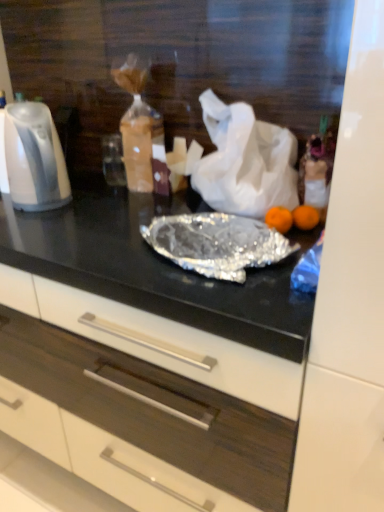
Question: Does white matte drawer at center have a greater height compared to white glossy electric kettle at left?

Choices:
 (A) no
 (B) yes

Answer: (B)

Question: Would you say white glossy electric kettle at left is part of white matte drawer at center's contents?

Choices:
 (A) no
 (B) yes

Answer: (A)

Question: Could you tell me if white matte drawer at center is turned towards white glossy electric kettle at left?

Choices:
 (A) yes
 (B) no

Answer: (B)

Question: Considering the relative positions of white matte drawer at center and white glossy electric kettle at left in the image provided, is white matte drawer at center to the right of white glossy electric kettle at left from the viewer's perspective?

Choices:
 (A) yes
 (B) no

Answer: (A)

Question: Does white matte drawer at center have a lesser width compared to white glossy electric kettle at left?

Choices:
 (A) no
 (B) yes

Answer: (A)

Question: Based on their sizes in the image, would you say white glossy electric kettle at left is bigger or smaller than white matte drawer at center?

Choices:
 (A) small
 (B) big

Answer: (A)

Question: Considering the positions of white glossy electric kettle at left and white matte drawer at center in the image, is white glossy electric kettle at left taller or shorter than white matte drawer at center?

Choices:
 (A) tall
 (B) short

Answer: (B)

Question: Considering the positions of white glossy electric kettle at left and white matte drawer at center in the image, is white glossy electric kettle at left wider or thinner than white matte drawer at center?

Choices:
 (A) thin
 (B) wide

Answer: (A)

Question: Is white glossy electric kettle at left in front of or behind white matte drawer at center in the image?

Choices:
 (A) behind
 (B) front

Answer: (A)

Question: Is white matte drawer at center bigger or smaller than white matte plastic bag at center?

Choices:
 (A) big
 (B) small

Answer: (A)

Question: Visually, is white matte drawer at center positioned to the left or to the right of white matte plastic bag at center?

Choices:
 (A) right
 (B) left

Answer: (B)

Question: From the image's perspective, relative to white matte plastic bag at center, is white matte drawer at center above or below?

Choices:
 (A) below
 (B) above

Answer: (A)

Question: Is white matte drawer at center wider or thinner than white matte plastic bag at center?

Choices:
 (A) wide
 (B) thin

Answer: (A)

Question: Looking at their shapes, would you say white matte drawer at center is wider or thinner than white glossy electric kettle at left?

Choices:
 (A) thin
 (B) wide

Answer: (B)

Question: In terms of height, does white matte drawer at center look taller or shorter compared to white glossy electric kettle at left?

Choices:
 (A) short
 (B) tall

Answer: (B)